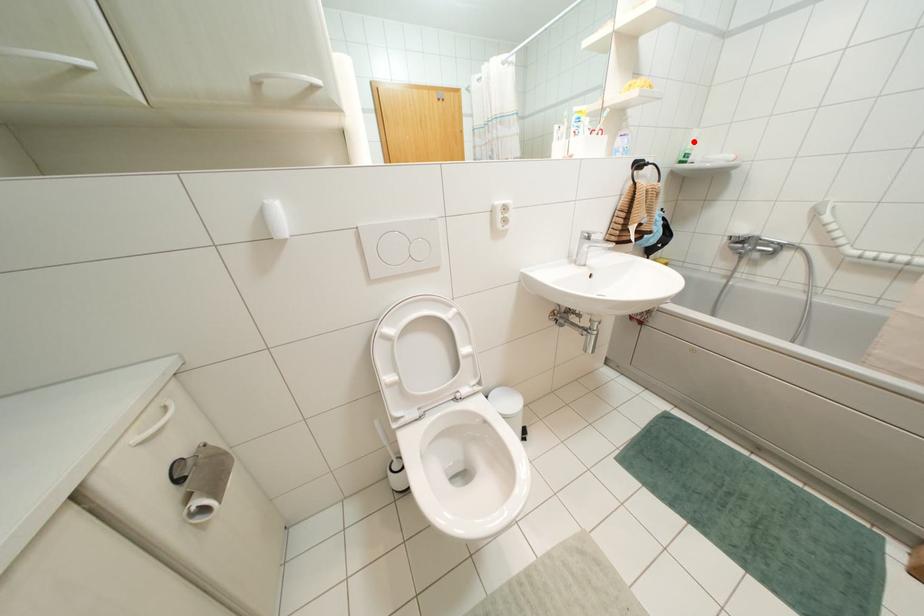
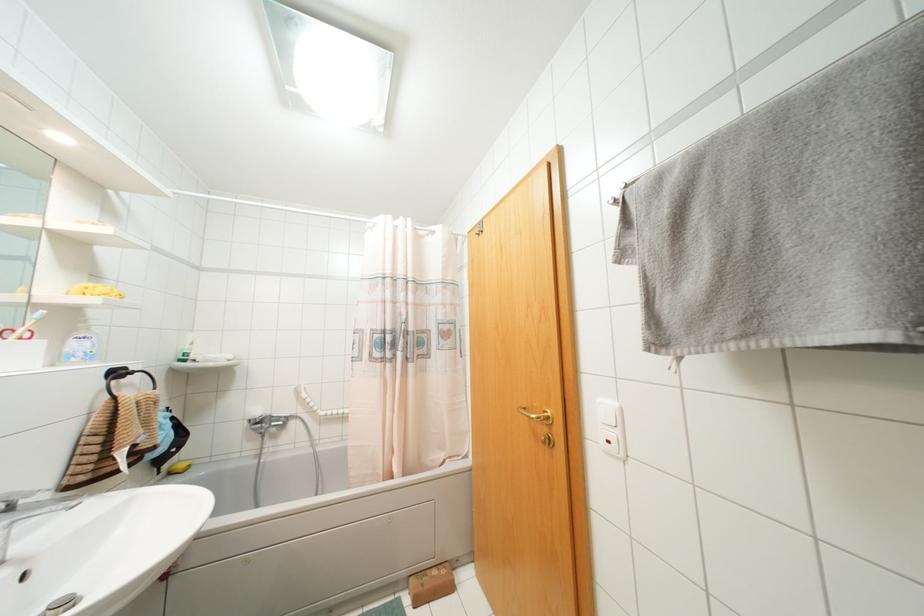
In the second image, find the point that corresponds to the highlighted location in the first image.

(190, 342)